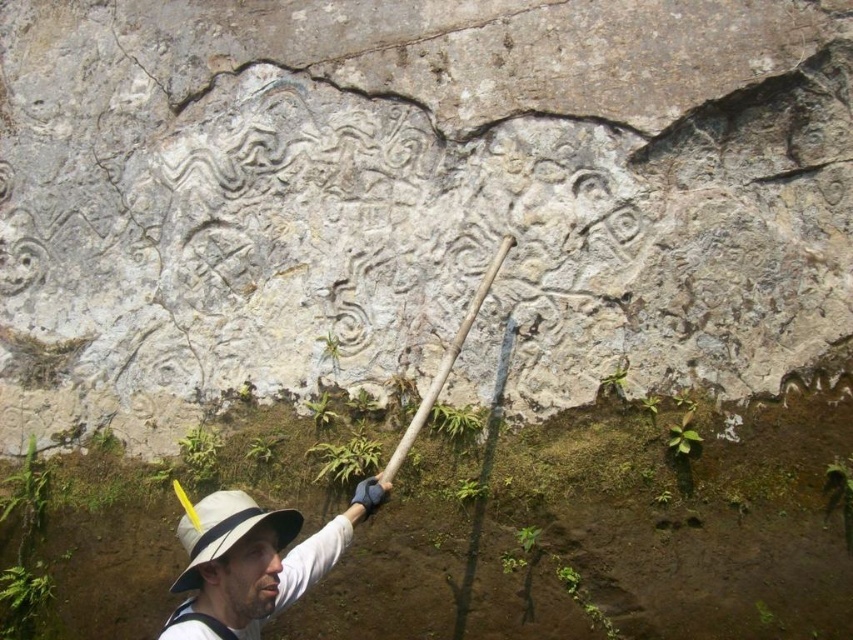
Question: Among these objects, which one is nearest to the camera?

Choices:
 (A) white hat at center
 (B) carved stone relief at upper center

Answer: (A)

Question: Can you confirm if white hat at center is wider than white fabric hat at lower left?

Choices:
 (A) no
 (B) yes

Answer: (B)

Question: Which object is the farthest from the white fabric hat at lower left?

Choices:
 (A) carved stone relief at upper center
 (B) wooden textured shovel at center
 (C) white hat at center

Answer: (A)

Question: Does carved stone relief at upper center come in front of wooden textured shovel at center?

Choices:
 (A) no
 (B) yes

Answer: (A)

Question: Is white hat at center thinner than white fabric hat at lower left?

Choices:
 (A) yes
 (B) no

Answer: (B)

Question: Which object appears closest to the camera in this image?

Choices:
 (A) wooden textured shovel at center
 (B) white fabric hat at lower left
 (C) white hat at center

Answer: (C)